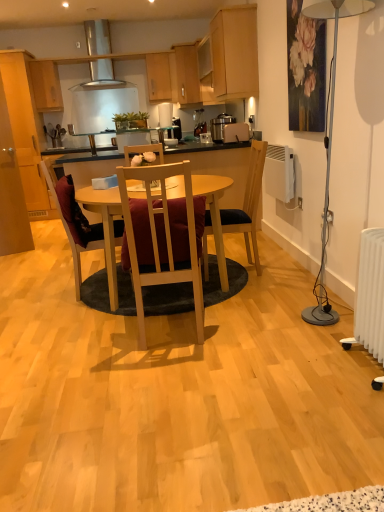
Locate an element on the screen. The height and width of the screenshot is (512, 384). vacant space positioned to the left of silver metallic floor lamp at right is located at coordinates (283, 324).